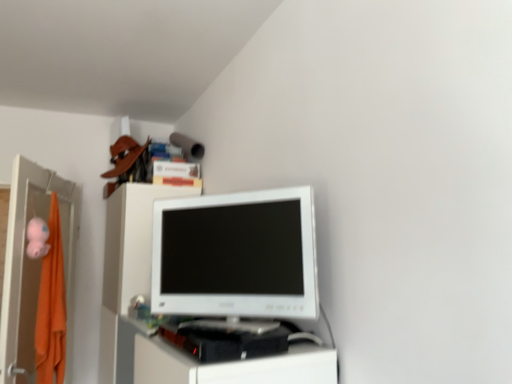
The width and height of the screenshot is (512, 384). Describe the element at coordinates (236, 255) in the screenshot. I see `white glossy computer monitor at center` at that location.

This screenshot has height=384, width=512. Find the location of `white glossy computer monitor at center`. white glossy computer monitor at center is located at coordinates pyautogui.click(x=236, y=255).

Looking at this image, in order to face white glossy computer monitor at center, should I rotate leftwards or rightwards?

A 4.427 degree turn to the left will do.

The height and width of the screenshot is (384, 512). What do you see at coordinates (33, 266) in the screenshot? I see `orange fabric file cabinet at left` at bounding box center [33, 266].

You are a GUI agent. You are given a task and a screenshot of the screen. Output one action in this format:
    pyautogui.click(x=<x>, y=<y>)
    Task: Click on the orange fabric file cabinet at left
    The height and width of the screenshot is (384, 512).
    Given the screenshot: What is the action you would take?
    pyautogui.click(x=33, y=266)

Find the location of a particular element. The width and height of the screenshot is (512, 384). white glossy computer monitor at center is located at coordinates (236, 255).

Is orange fabric file cabinet at left at the left side of white glossy computer monitor at center?

Indeed, orange fabric file cabinet at left is positioned on the left side of white glossy computer monitor at center.

Does orange fabric file cabinet at left lie behind white glossy computer monitor at center?

Yes, it is behind white glossy computer monitor at center.

Does point (0, 364) appear closer or farther from the camera than point (289, 280)?

Point (0, 364) is positioned farther from the camera compared to point (289, 280).

From the image's perspective, is orange fabric file cabinet at left over white glossy computer monitor at center?

Actually, orange fabric file cabinet at left appears below white glossy computer monitor at center in the image.

From a real-world perspective, relative to white glossy computer monitor at center, is orange fabric file cabinet at left vertically above or below?

From a real-world perspective, orange fabric file cabinet at left is physically below white glossy computer monitor at center.

Which of these two, orange fabric file cabinet at left or white glossy computer monitor at center, is thinner?

white glossy computer monitor at center is thinner.

Looking at this image, which of these two, orange fabric file cabinet at left or white glossy computer monitor at center, stands taller?

orange fabric file cabinet at left is taller.

Does orange fabric file cabinet at left have a larger size compared to white glossy computer monitor at center?

Indeed, orange fabric file cabinet at left has a larger size compared to white glossy computer monitor at center.

Is orange fabric file cabinet at left positioned beyond the bounds of white glossy computer monitor at center?

Absolutely, orange fabric file cabinet at left is external to white glossy computer monitor at center.

Is orange fabric file cabinet at left next to white glossy computer monitor at center and touching it?

orange fabric file cabinet at left is not next to white glossy computer monitor at center, and they're not touching.

Is orange fabric file cabinet at left aimed at white glossy computer monitor at center?

No, orange fabric file cabinet at left is not oriented towards white glossy computer monitor at center.

What's the angular difference between orange fabric file cabinet at left and white glossy computer monitor at center's facing directions?

60.2 degrees.

How distant is orange fabric file cabinet at left from white glossy computer monitor at center?

3.47 feet.

This screenshot has width=512, height=384. In order to click on file cabinet on the left of white glossy computer monitor at center in this screenshot , I will do `click(33, 266)`.

Based on their positions, is white glossy computer monitor at center located to the left or right of orange fabric file cabinet at left?

In the image, white glossy computer monitor at center appears on the right side of orange fabric file cabinet at left.

Is white glossy computer monitor at center further to camera compared to orange fabric file cabinet at left?

No, it is in front of orange fabric file cabinet at left.

Considering the points (173, 207) and (16, 187), which point is behind, point (173, 207) or point (16, 187)?

The point (16, 187) is more distant.

From the image's perspective, is white glossy computer monitor at center positioned above or below orange fabric file cabinet at left?

Clearly, from the image's perspective, white glossy computer monitor at center is above orange fabric file cabinet at left.

From a real-world perspective, is white glossy computer monitor at center positioned under orange fabric file cabinet at left based on gravity?

Incorrect, from a real-world perspective, white glossy computer monitor at center is higher than orange fabric file cabinet at left.

Is white glossy computer monitor at center wider than orange fabric file cabinet at left?

No, white glossy computer monitor at center is not wider than orange fabric file cabinet at left.

Between white glossy computer monitor at center and orange fabric file cabinet at left, which one has less height?

With less height is white glossy computer monitor at center.

Does white glossy computer monitor at center have a smaller size compared to orange fabric file cabinet at left?

Yes, white glossy computer monitor at center is smaller than orange fabric file cabinet at left.

Is orange fabric file cabinet at left completely or partially inside white glossy computer monitor at center?

That's incorrect, orange fabric file cabinet at left is not inside white glossy computer monitor at center.

Is white glossy computer monitor at center directly adjacent to orange fabric file cabinet at left?

No, white glossy computer monitor at center is not touching orange fabric file cabinet at left.

Could you tell me if white glossy computer monitor at center is facing orange fabric file cabinet at left?

No, white glossy computer monitor at center is not facing towards orange fabric file cabinet at left.

How different are the orientations of white glossy computer monitor at center and orange fabric file cabinet at left in degrees?

The angle between the facing direction of white glossy computer monitor at center and the facing direction of orange fabric file cabinet at left is 60.2 degrees.

How far apart are white glossy computer monitor at center and orange fabric file cabinet at left?

They are 1.06 meters apart.

You are a GUI agent. You are given a task and a screenshot of the screen. Output one action in this format:
    pyautogui.click(x=<x>, y=<y>)
    Task: Click on the file cabinet below the white glossy computer monitor at center (from the image's perspective)
    This screenshot has height=384, width=512.
    Given the screenshot: What is the action you would take?
    pyautogui.click(x=33, y=266)

You are a GUI agent. You are given a task and a screenshot of the screen. Output one action in this format:
    pyautogui.click(x=<x>, y=<y>)
    Task: Click on the computer monitor above the orange fabric file cabinet at left (from the image's perspective)
    The height and width of the screenshot is (384, 512).
    Given the screenshot: What is the action you would take?
    pyautogui.click(x=236, y=255)

In order to click on file cabinet behind the white glossy computer monitor at center in this screenshot , I will do `click(33, 266)`.